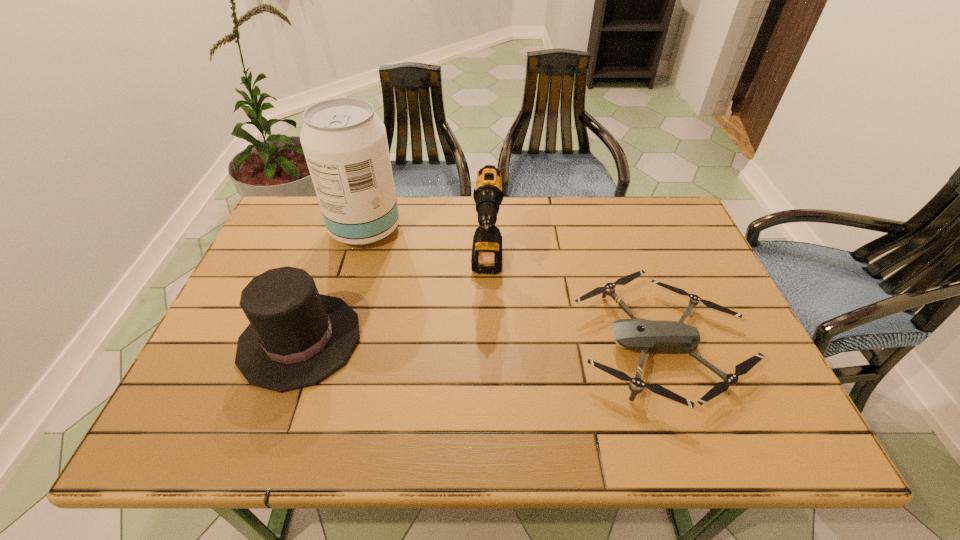
In order to click on free space between the tallest object and the dress hat in this screenshot , I will do `click(333, 285)`.

Identify the location of free area in between the drill and the tallest object. Image resolution: width=960 pixels, height=540 pixels. (426, 249).

This screenshot has height=540, width=960. Identify the location of blank region between the dress hat and the rightmost object. (481, 342).

You are a GUI agent. You are given a task and a screenshot of the screen. Output one action in this format:
    pyautogui.click(x=<x>, y=<y>)
    Task: Click on the object that is the third closest to the shortest object
    This screenshot has width=960, height=540.
    Given the screenshot: What is the action you would take?
    pyautogui.click(x=297, y=337)

Identify which object is located as the nearest to the dress hat. Please provide its 2D coordinates. Your answer should be formatted as a tuple, i.e. [(x, y)], where the tuple contains the x and y coordinates of a point satisfying the conditions above.

[(345, 144)]